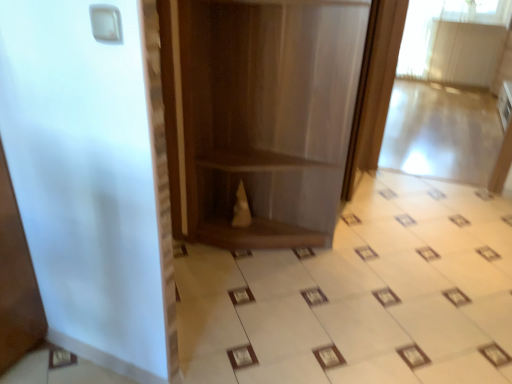
Question: From the image's perspective, is white glossy ceramic tile at center located beneath matte brown bookshelf at center?

Choices:
 (A) no
 (B) yes

Answer: (B)

Question: Does white glossy ceramic tile at center have a lesser height compared to matte brown bookshelf at center?

Choices:
 (A) yes
 (B) no

Answer: (A)

Question: Is white glossy ceramic tile at center not within matte brown bookshelf at center?

Choices:
 (A) yes
 (B) no

Answer: (A)

Question: Are white glossy ceramic tile at center and matte brown bookshelf at center located far from each other?

Choices:
 (A) yes
 (B) no

Answer: (B)

Question: From the image's perspective, is white glossy ceramic tile at center on top of matte brown bookshelf at center?

Choices:
 (A) no
 (B) yes

Answer: (A)

Question: Can you confirm if white glossy ceramic tile at center is wider than matte brown bookshelf at center?

Choices:
 (A) yes
 (B) no

Answer: (A)

Question: Is matte brown bookshelf at center far from white glossy ceramic tile at center?

Choices:
 (A) no
 (B) yes

Answer: (A)

Question: Is matte brown bookshelf at center positioned before white glossy ceramic tile at center?

Choices:
 (A) yes
 (B) no

Answer: (B)

Question: Is matte brown bookshelf at center taller than white glossy ceramic tile at center?

Choices:
 (A) yes
 (B) no

Answer: (A)

Question: Can you confirm if matte brown bookshelf at center is wider than white glossy ceramic tile at center?

Choices:
 (A) no
 (B) yes

Answer: (A)

Question: Does matte brown bookshelf at center appear on the right side of white glossy ceramic tile at center?

Choices:
 (A) no
 (B) yes

Answer: (A)

Question: Is white glossy ceramic tile at center located within matte brown bookshelf at center?

Choices:
 (A) no
 (B) yes

Answer: (A)

Question: From the image's perspective, is matte brown bookshelf at center above or below white glossy ceramic tile at center?

Choices:
 (A) above
 (B) below

Answer: (A)